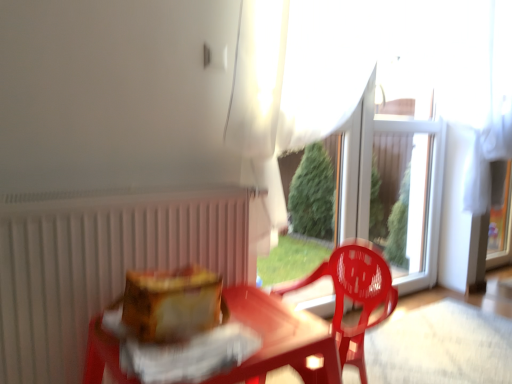
Question: Does point (44, 256) appear closer or farther from the camera than point (227, 109)?

Choices:
 (A) closer
 (B) farther

Answer: (A)

Question: Is white matte radiator at left taller or shorter than white sheer curtain at upper center?

Choices:
 (A) tall
 (B) short

Answer: (B)

Question: Estimate the real-world distances between objects in this image. Which object is farther from the white matte radiator at left?

Choices:
 (A) white sheer curtain at upper center
 (B) translucent plastic chair at center
 (C) translucent plastic table at center
 (D) transparent glass window at center
 (E) transparent plastic glass door at center

Answer: (E)

Question: Considering the real-world distances, which object is closest to the white sheer curtain at upper center?

Choices:
 (A) transparent glass window at center
 (B) translucent plastic table at center
 (C) transparent plastic glass door at center
 (D) white matte radiator at left
 (E) translucent plastic chair at center

Answer: (D)